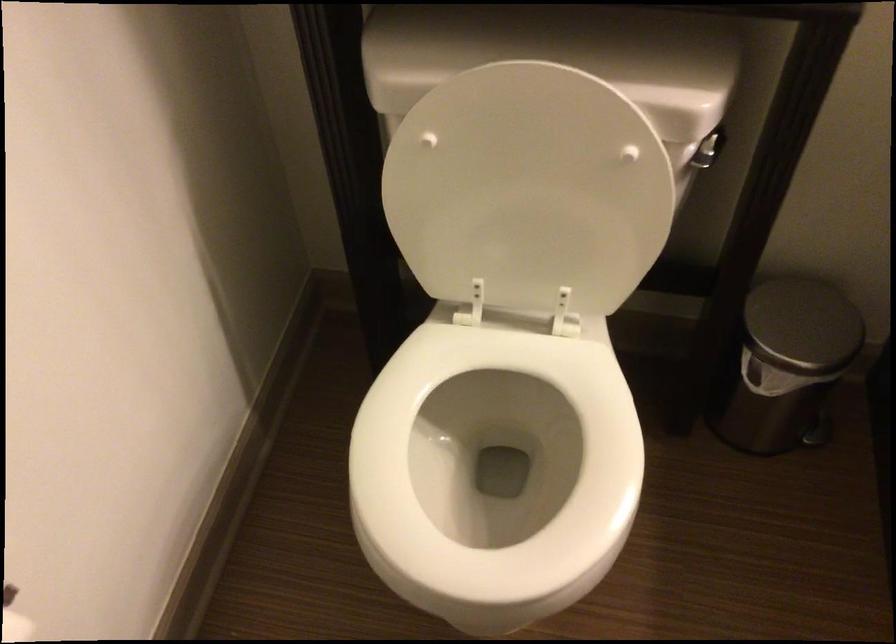
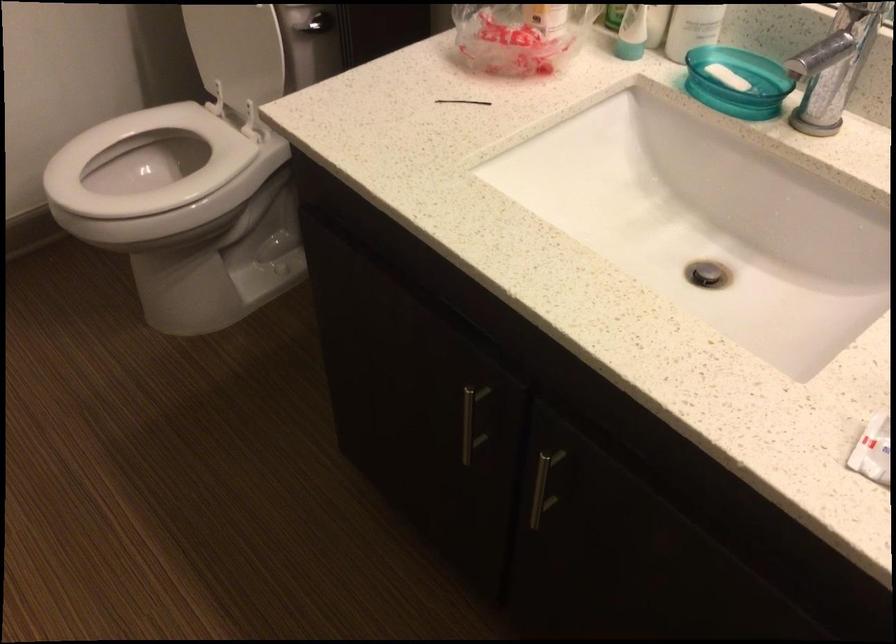
In the second image, find the point that corresponds to (x=391, y=440) in the first image.

(144, 163)